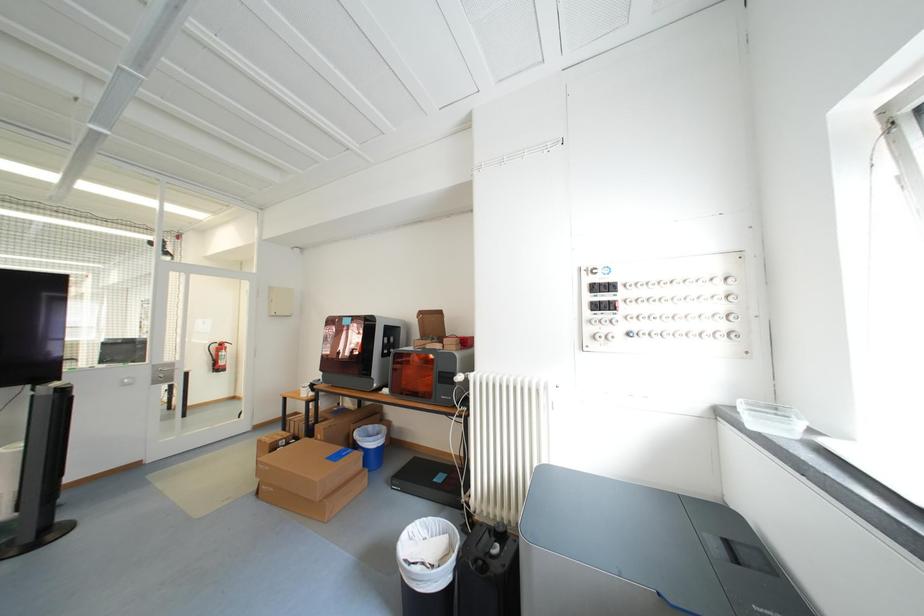
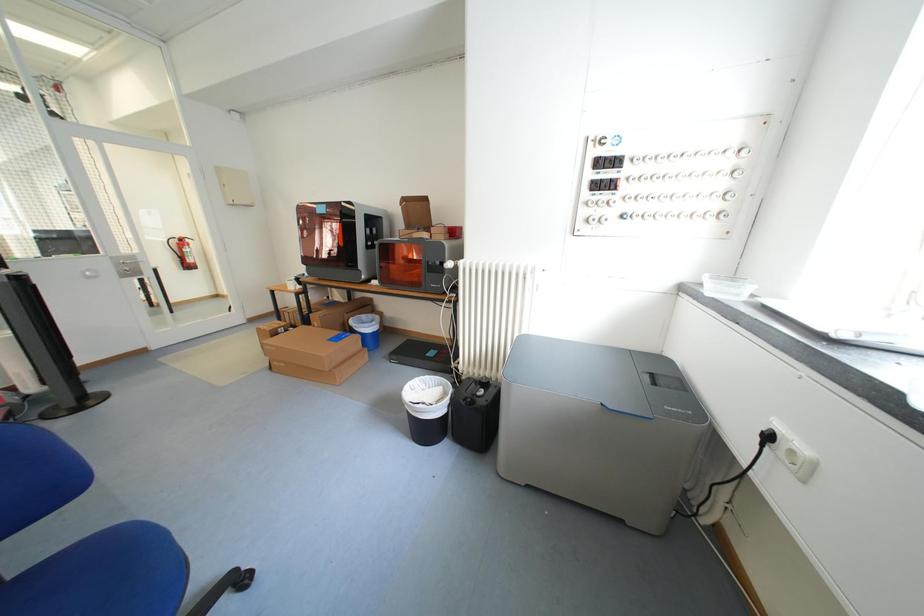
Question: Based on the continuous images, in which direction is the camera rotating? Reply with the corresponding letter.

Choices:
 (A) Left
 (B) Right
 (C) Up
 (D) Down

Answer: (D)